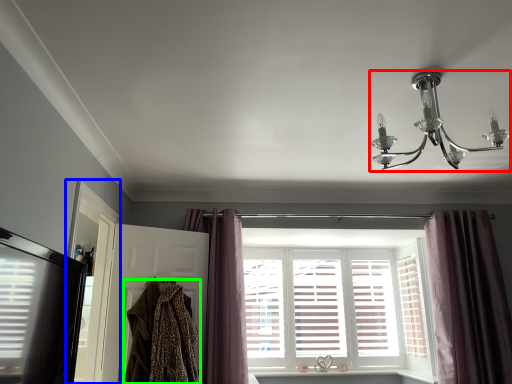
Question: Considering the real-world distances, which object is farthest from lamp (highlighted by a red box)? screen door (highlighted by a blue box) or clothing (highlighted by a green box)?

Choices:
 (A) screen door
 (B) clothing

Answer: (A)